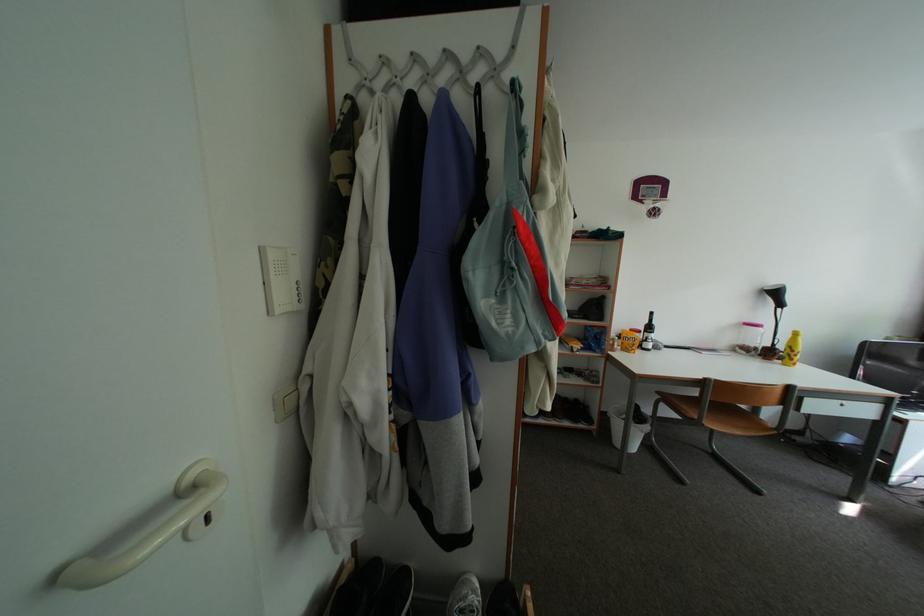
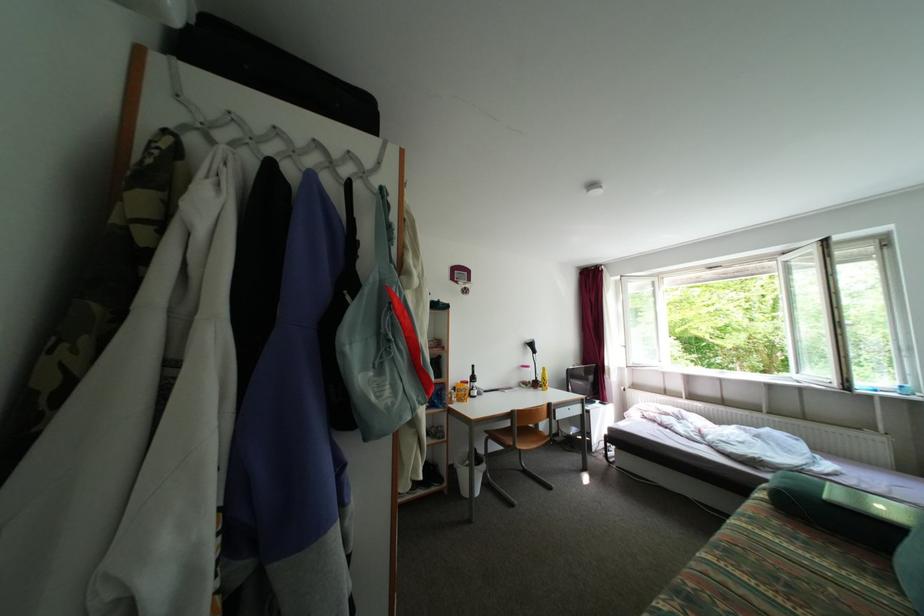
Question: The first image is from the beginning of the video and the second image is from the end. How did the camera likely rotate when shooting the video?

Choices:
 (A) Left
 (B) Right
 (C) Up
 (D) Down

Answer: (B)